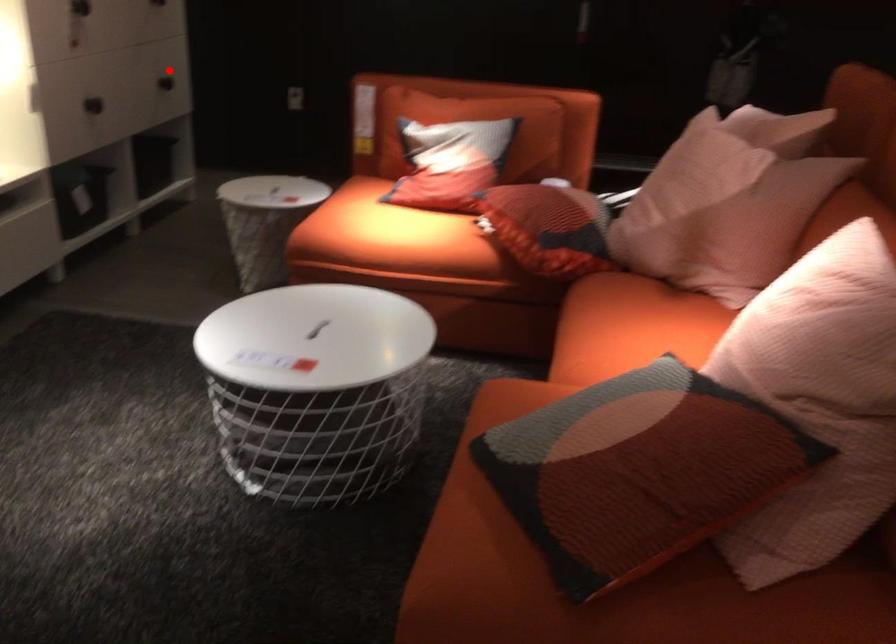
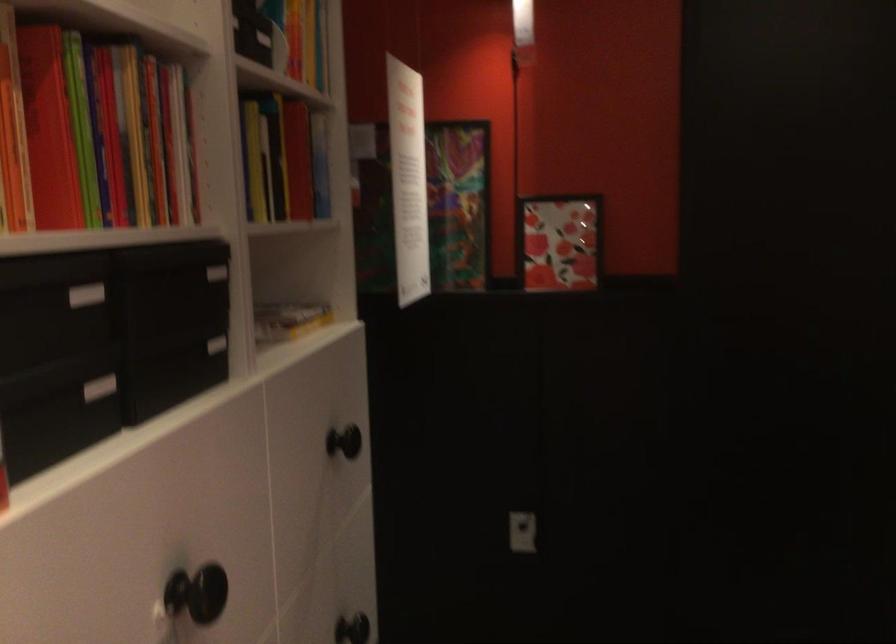
Locate, in the second image, the point that corresponds to the highlighted location in the first image.

(351, 629)